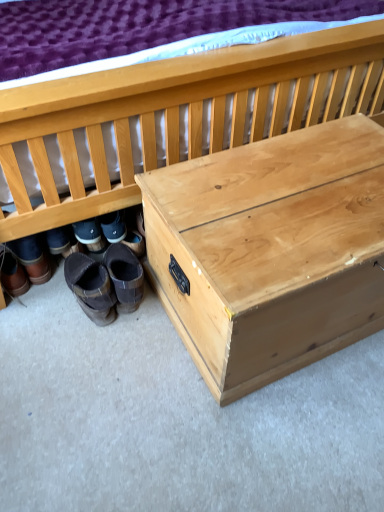
I want to click on free space above natural wood trunk at center (from a real-world perspective), so click(x=307, y=187).